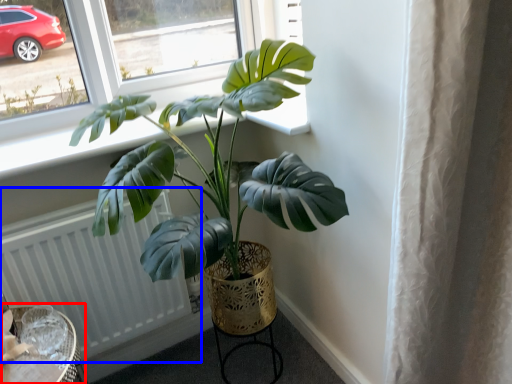
Question: Which point is further to the camera, round table (highlighted by a red box) or radiator (highlighted by a blue box)?

Choices:
 (A) round table
 (B) radiator

Answer: (B)